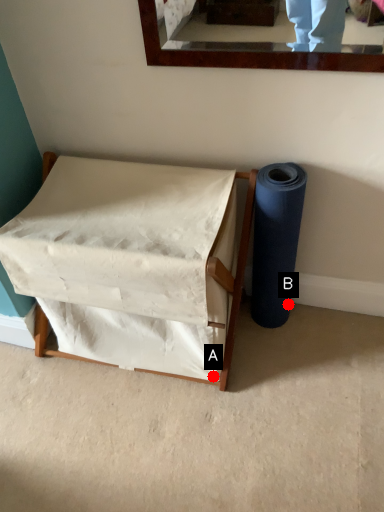
Question: Two points are circled on the image, labeled by A and B beside each circle. Which point is closer to the camera?

Choices:
 (A) A is closer
 (B) B is closer

Answer: (A)